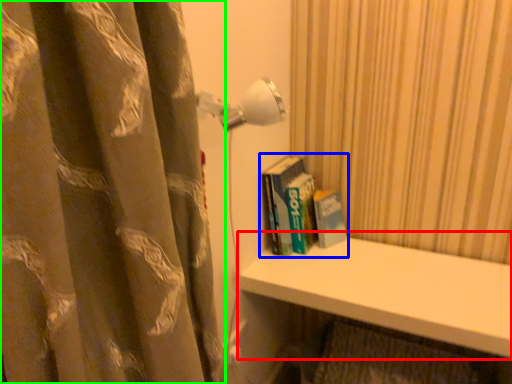
Question: Based on their relative distances, which object is farther from window sill (highlighted by a red box)? Choose from book (highlighted by a blue box) and curtain (highlighted by a green box).

Choices:
 (A) book
 (B) curtain

Answer: (B)